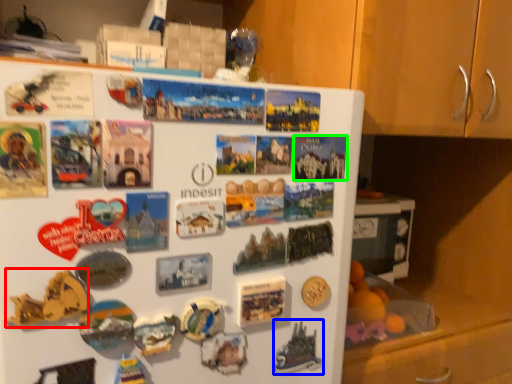
Question: Which object is positioned closest to art (highlighted by a red box)? Select from art (highlighted by a blue box) and postcard (highlighted by a green box).

Choices:
 (A) art
 (B) postcard

Answer: (A)